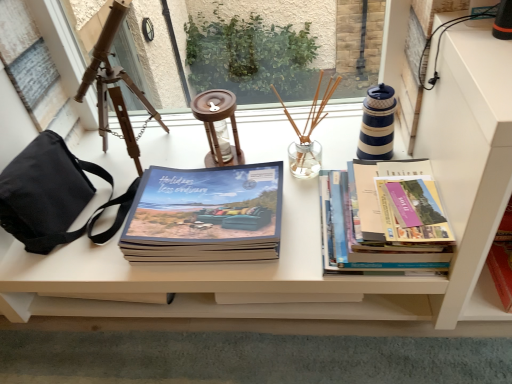
In order to face matte blue book at center, the first book in the left-to-right sequence, should I rotate leftwards or rightwards?

A 6.536 degree turn to the left will do.

Describe the element at coordinates (205, 215) in the screenshot. This screenshot has width=512, height=384. I see `matte blue book at center, the first book in the left-to-right sequence` at that location.

The image size is (512, 384). What are the coordinates of `hardcover book at lower right, the 1th book when ordered from right to left` in the screenshot? It's located at (503, 259).

The width and height of the screenshot is (512, 384). Describe the element at coordinates (53, 195) in the screenshot. I see `black canvas bag at left` at that location.

Locate an element on the screen. This screenshot has width=512, height=384. wooden tripod at left is located at coordinates (114, 87).

The width and height of the screenshot is (512, 384). In order to click on matte blue book at center, the first book in the left-to-right sequence in this screenshot , I will do `click(205, 215)`.

Image resolution: width=512 pixels, height=384 pixels. I want to click on book that is the 2nd one below the wooden tripod at left (from a real-world perspective), so click(x=205, y=215).

Is wooden tripod at left facing away from matte blue book at center, placed as the third book when sorted from right to left?

That's not correct — wooden tripod at left is not looking away from matte blue book at center, placed as the third book when sorted from right to left.

From the picture: From the image's perspective, is wooden tripod at left beneath matte blue book at center, the first book in the left-to-right sequence?

No.

Is matte blue book at center, placed as the third book when sorted from right to left, surrounded by wooden tripod at left?

No, matte blue book at center, placed as the third book when sorted from right to left, is not surrounded by wooden tripod at left.

In the scene shown: Is blue and white striped lighthouse at upper right, placed as the third candle holder when sorted from left to right, closer to the viewer compared to wooden candle holder at center, arranged as the first candle holder when viewed from the left?

Yes, it is.

From the image's perspective, between blue and white striped lighthouse at upper right, placed as the third candle holder when sorted from left to right, and wooden candle holder at center, which is the 3th candle holder from right to left, which one is located above?

blue and white striped lighthouse at upper right, placed as the third candle holder when sorted from left to right, from the image's perspective.

Is wooden candle holder at center, which is the 3th candle holder from right to left, completely or partially inside blue and white striped lighthouse at upper right, placed as the third candle holder when sorted from left to right?

Definitely not — wooden candle holder at center, which is the 3th candle holder from right to left, is not inside blue and white striped lighthouse at upper right, placed as the third candle holder when sorted from left to right.

In the scene shown: From the image's perspective, is hardcover books at right, which is counted as the 2th book, starting from the right, beneath black canvas bag at left?

Indeed, from the image's perspective, hardcover books at right, which is counted as the 2th book, starting from the right, is shown beneath black canvas bag at left.

Is hardcover books at right, arranged as the 2th book when viewed from the left, shorter than black canvas bag at left?

Correct, hardcover books at right, arranged as the 2th book when viewed from the left, is not as tall as black canvas bag at left.

Between hardcover books at right, which is counted as the 2th book, starting from the right, and black canvas bag at left, which one appears on the left side from the viewer's perspective?

From the viewer's perspective, black canvas bag at left appears more on the left side.

How far apart are hardcover books at right, which is counted as the 2th book, starting from the right, and black canvas bag at left?

21.51 inches.

From the image's perspective, is black canvas bag at left located above or below blue and white striped lighthouse at upper right, which ranks as the 1th candle holder in right-to-left order?

From the image's perspective, black canvas bag at left appears below blue and white striped lighthouse at upper right, which ranks as the 1th candle holder in right-to-left order.

Does black canvas bag at left have a greater width compared to blue and white striped lighthouse at upper right, which ranks as the 1th candle holder in right-to-left order?

Correct, the width of black canvas bag at left exceeds that of blue and white striped lighthouse at upper right, which ranks as the 1th candle holder in right-to-left order.

Can blue and white striped lighthouse at upper right, which ranks as the 1th candle holder in right-to-left order, be found inside black canvas bag at left?

Definitely not — blue and white striped lighthouse at upper right, which ranks as the 1th candle holder in right-to-left order, is not inside black canvas bag at left.

From a real-world perspective, which is physically below, matte blue book at center, the first book in the left-to-right sequence, or wooden candle holder at center, which is the 3th candle holder from right to left?

From a 3D spatial view, matte blue book at center, the first book in the left-to-right sequence, is below.

Does matte blue book at center, placed as the third book when sorted from right to left, have a lesser height compared to wooden candle holder at center, arranged as the first candle holder when viewed from the left?

Yes.

Which of these two, matte blue book at center, the first book in the left-to-right sequence, or wooden candle holder at center, arranged as the first candle holder when viewed from the left, is bigger?

matte blue book at center, the first book in the left-to-right sequence, is bigger.

Could you tell me if matte blue book at center, placed as the third book when sorted from right to left, is turned towards wooden candle holder at center, which is the 3th candle holder from right to left?

No.

Can you confirm if blue and white striped lighthouse at upper right, placed as the third candle holder when sorted from left to right, is smaller than clear glass vase at center, which is the 2th candle holder from right to left?

Indeed, blue and white striped lighthouse at upper right, placed as the third candle holder when sorted from left to right, has a smaller size compared to clear glass vase at center, which is the 2th candle holder from right to left.

Is blue and white striped lighthouse at upper right, placed as the third candle holder when sorted from left to right, looking in the opposite direction of clear glass vase at center, which is the 2th candle holder from right to left?

blue and white striped lighthouse at upper right, placed as the third candle holder when sorted from left to right, does not have its back to clear glass vase at center, which is the 2th candle holder from right to left.

Locate an element on the screen. Image resolution: width=512 pixels, height=384 pixels. candle holder positioned vertically above the blue and white striped lighthouse at upper right, which ranks as the 1th candle holder in right-to-left order (from a real-world perspective) is located at coordinates (308, 134).

How distant is blue and white striped lighthouse at upper right, placed as the third candle holder when sorted from left to right, from clear glass vase at center, the second candle holder when ordered from left to right?

They are 4.93 inches apart.

Can you confirm if hardcover books at right, arranged as the 2th book when viewed from the left, is smaller than hardcover book at lower right, positioned as the third book in left-to-right order?

No.

Is the depth of hardcover books at right, arranged as the 2th book when viewed from the left, greater than that of hardcover book at lower right, positioned as the third book in left-to-right order?

No, hardcover books at right, arranged as the 2th book when viewed from the left, is closer to the viewer.

From the picture: Can you confirm if hardcover books at right, which is counted as the 2th book, starting from the right, is wider than hardcover book at lower right, the 1th book when ordered from right to left?

Yes, hardcover books at right, which is counted as the 2th book, starting from the right, is wider than hardcover book at lower right, the 1th book when ordered from right to left.

Who is shorter, hardcover books at right, arranged as the 2th book when viewed from the left, or hardcover book at lower right, the 1th book when ordered from right to left?

hardcover books at right, arranged as the 2th book when viewed from the left.

This screenshot has height=384, width=512. Identify the location of book that is the 2nd one when counting downward from the wooden tripod at left (from the image's perspective). (205, 215).

At what (x,y) coordinates should I click in order to perform the action: click on the 2nd candle holder counting from the left of the blue and white striped lighthouse at upper right, which ranks as the 1th candle holder in right-to-left order. Please return your answer as a coordinate pair (x, y). This screenshot has width=512, height=384. Looking at the image, I should click on (x=218, y=126).

From the image, which object appears to be farther from wooden candle holder at center, arranged as the first candle holder when viewed from the left, hardcover books at right, arranged as the 2th book when viewed from the left, or clear glass vase at center, which is the 2th candle holder from right to left?

hardcover books at right, arranged as the 2th book when viewed from the left, lies further to wooden candle holder at center, arranged as the first candle holder when viewed from the left, than the other object.

When comparing their distances from wooden candle holder at center, which is the 3th candle holder from right to left, does black canvas bag at left or clear glass vase at center, the second candle holder when ordered from left to right, seem further?

black canvas bag at left.

From the image, which object appears to be farther from clear glass vase at center, which is the 2th candle holder from right to left, hardcover book at lower right, positioned as the third book in left-to-right order, or wooden candle holder at center, which is the 3th candle holder from right to left?

hardcover book at lower right, positioned as the third book in left-to-right order, is positioned further to the anchor clear glass vase at center, which is the 2th candle holder from right to left.

Looking at the image, which one is located further to wooden candle holder at center, arranged as the first candle holder when viewed from the left, blue and white striped lighthouse at upper right, which ranks as the 1th candle holder in right-to-left order, or clear glass vase at center, the second candle holder when ordered from left to right?

blue and white striped lighthouse at upper right, which ranks as the 1th candle holder in right-to-left order.

Looking at the image, which one is located further to blue and white striped lighthouse at upper right, placed as the third candle holder when sorted from left to right, hardcover book at lower right, positioned as the third book in left-to-right order, or matte blue book at center, placed as the third book when sorted from right to left?

The object further to blue and white striped lighthouse at upper right, placed as the third candle holder when sorted from left to right, is matte blue book at center, placed as the third book when sorted from right to left.

When comparing their distances from wooden candle holder at center, which is the 3th candle holder from right to left, does wooden tripod at left or hardcover book at lower right, the 1th book when ordered from right to left, seem further?

hardcover book at lower right, the 1th book when ordered from right to left, is further to wooden candle holder at center, which is the 3th candle holder from right to left.

Considering their positions, is matte blue book at center, the first book in the left-to-right sequence, positioned further to clear glass vase at center, which is the 2th candle holder from right to left, than black canvas bag at left?

The object further to clear glass vase at center, which is the 2th candle holder from right to left, is black canvas bag at left.

Which object lies nearer to the anchor point blue and white striped lighthouse at upper right, which ranks as the 1th candle holder in right-to-left order, hardcover book at lower right, positioned as the third book in left-to-right order, or hardcover books at right, arranged as the 2th book when viewed from the left?

hardcover books at right, arranged as the 2th book when viewed from the left, is closer to blue and white striped lighthouse at upper right, which ranks as the 1th candle holder in right-to-left order.

This screenshot has height=384, width=512. Identify the location of candle holder between clear glass vase at center, which is the 2th candle holder from right to left, and hardcover book at lower right, the 1th book when ordered from right to left. (377, 124).

Locate an element on the screen. The image size is (512, 384). candle holder situated between wooden candle holder at center, which is the 3th candle holder from right to left, and blue and white striped lighthouse at upper right, which ranks as the 1th candle holder in right-to-left order, from left to right is located at coordinates (308, 134).

Where is `book between black canvas bag at left and clear glass vase at center, the second candle holder when ordered from left to right, from left to right`? This screenshot has height=384, width=512. book between black canvas bag at left and clear glass vase at center, the second candle holder when ordered from left to right, from left to right is located at coordinates (205, 215).

Find the location of a particular element. Image resolution: width=512 pixels, height=384 pixels. candle holder between matte blue book at center, placed as the third book when sorted from right to left, and clear glass vase at center, which is the 2th candle holder from right to left is located at coordinates (218, 126).